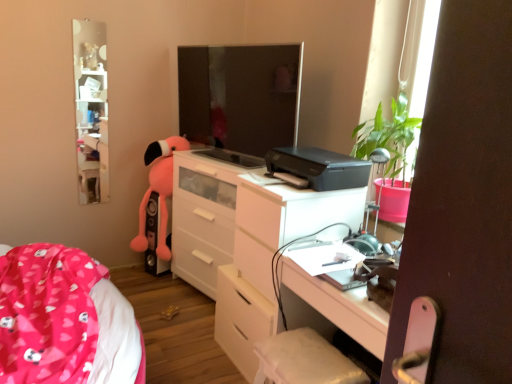
In order to click on free point above white fabric swivel chair at lower center (from a real-world perspective) in this screenshot , I will do `click(309, 355)`.